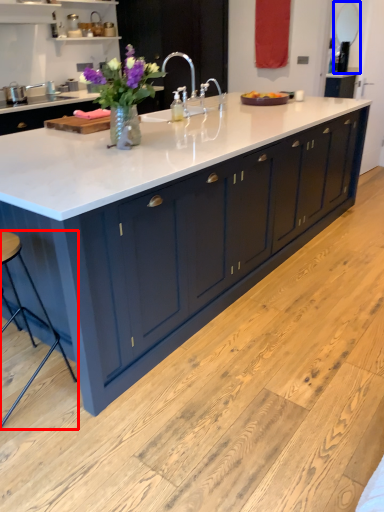
Question: Which of the following is the farthest to the observer, bar stool (highlighted by a red box) or mirror (highlighted by a blue box)?

Choices:
 (A) bar stool
 (B) mirror

Answer: (B)